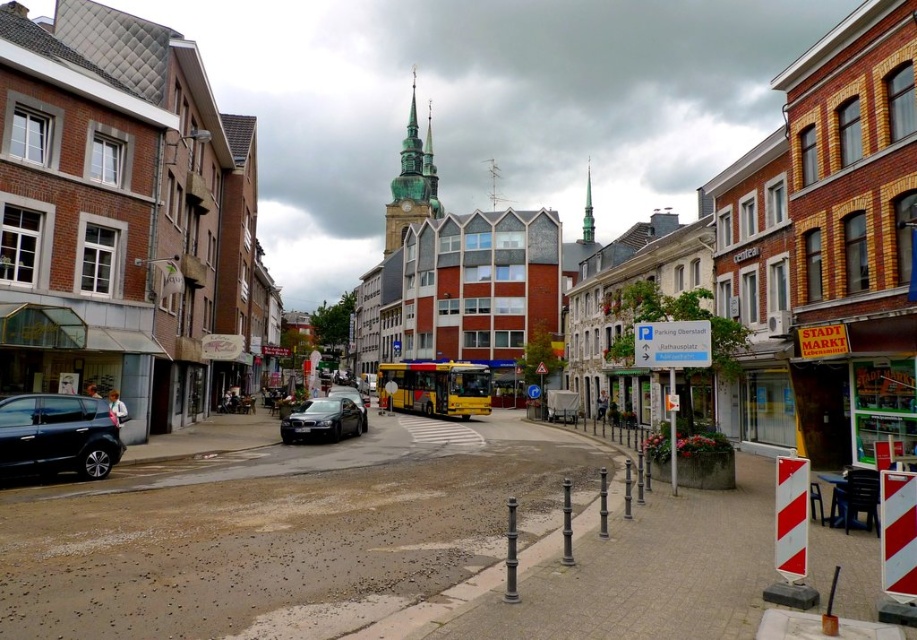
You are a tourist standing at the edge of the street in this European town. You notice a green copper spire at center and a satin black sedan at center. Which object would appear taller to you from your current position?

The green copper spire at center appears taller than the satin black sedan at center because it has a larger size compared to the sedan.

You are a pedestrian standing at the crosswalk near the shiny black car at lower left and the satin black sedan at center. Which vehicle is positioned more to the left?

The satin black sedan at center is positioned more to the left than the shiny black car at lower left.